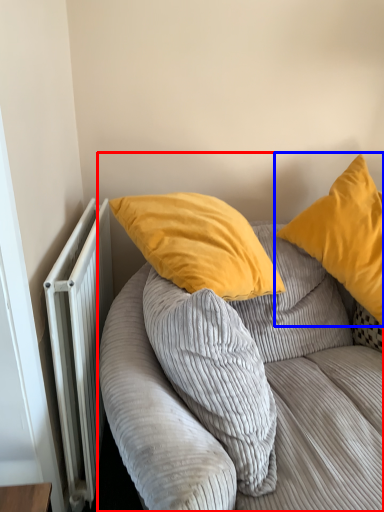
Question: Which object appears farthest to the camera in this image, studio couch (highlighted by a red box) or pillow (highlighted by a blue box)?

Choices:
 (A) studio couch
 (B) pillow

Answer: (B)